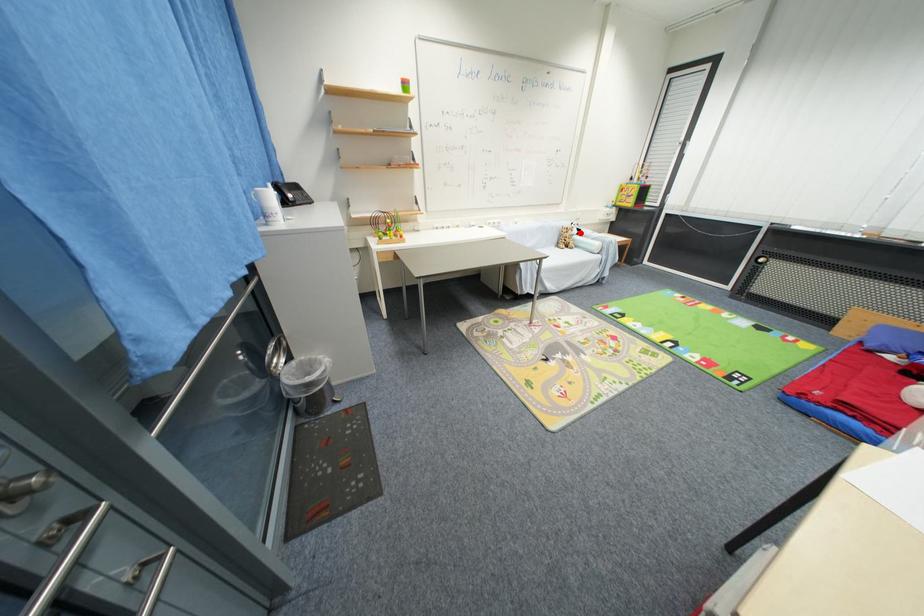
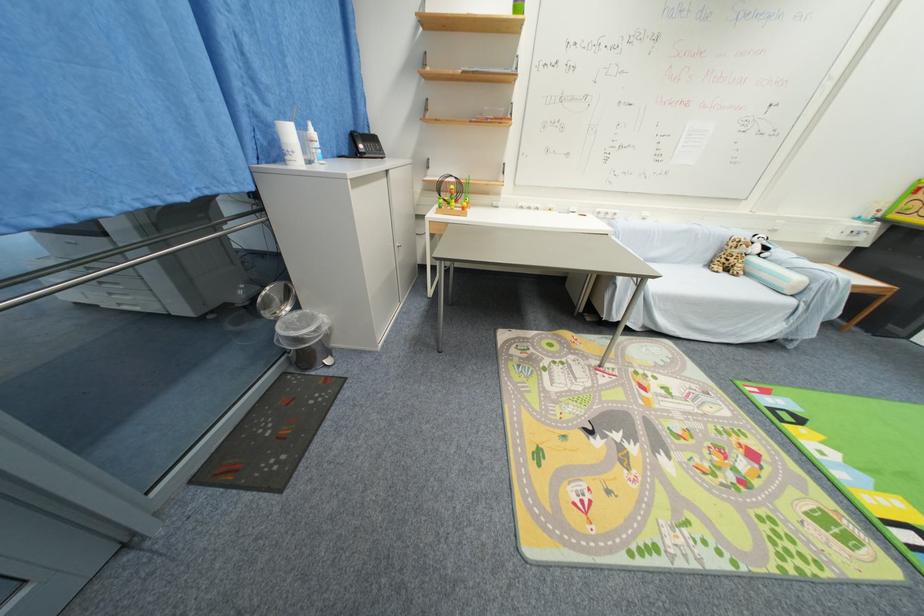
Question: I am providing you with two images of the same scene from different viewpoints. A red point is shown in image1. For the corresponding object point in image2, is it positioned nearer or farther from the camera?

Choices:
 (A) Nearer
 (B) Farther

Answer: (B)